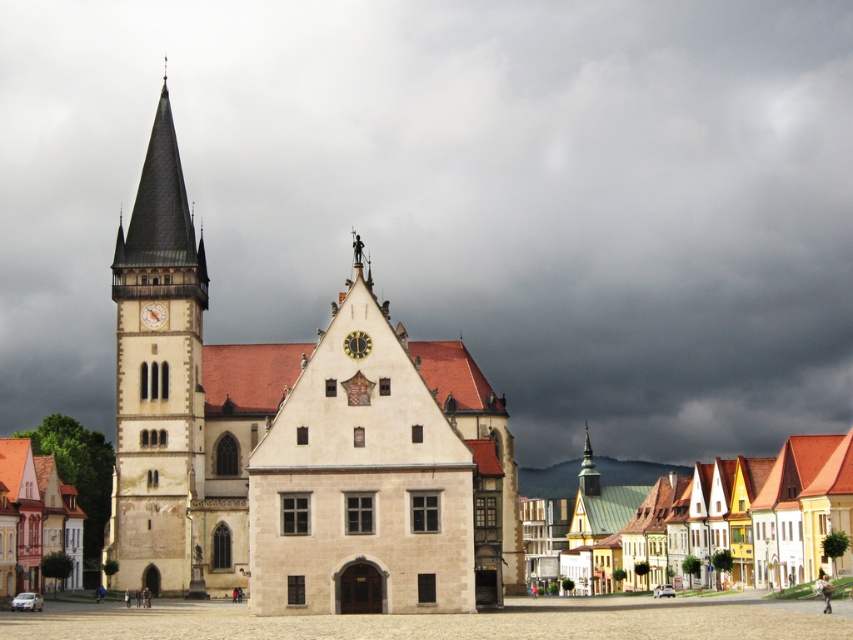
Question: Estimate the real-world distances between objects in this image. Which object is closer to the white stone tower at left?

Choices:
 (A) beige stone church at center
 (B) white painted wooden houses at lower right
 (C) gold metallic clock at center

Answer: (A)

Question: Where is white stone church at center located in relation to white painted wooden houses at lower right in the image?

Choices:
 (A) above
 (B) below

Answer: (A)

Question: Does dark gray cloud at upper center have a greater width compared to beige stone church at center?

Choices:
 (A) yes
 (B) no

Answer: (A)

Question: Which of the following is the closest to the observer?

Choices:
 (A) (392, 426)
 (B) (585, 422)
 (C) (349, 355)
 (D) (258, 588)

Answer: (D)

Question: Which point is closer to the camera?

Choices:
 (A) beige stone church at center
 (B) gold textured spire at center
 (C) white stone church at center
 (D) white stone tower at left

Answer: (A)

Question: Does white stone tower at left have a smaller size compared to gold metallic clock at center?

Choices:
 (A) no
 (B) yes

Answer: (A)